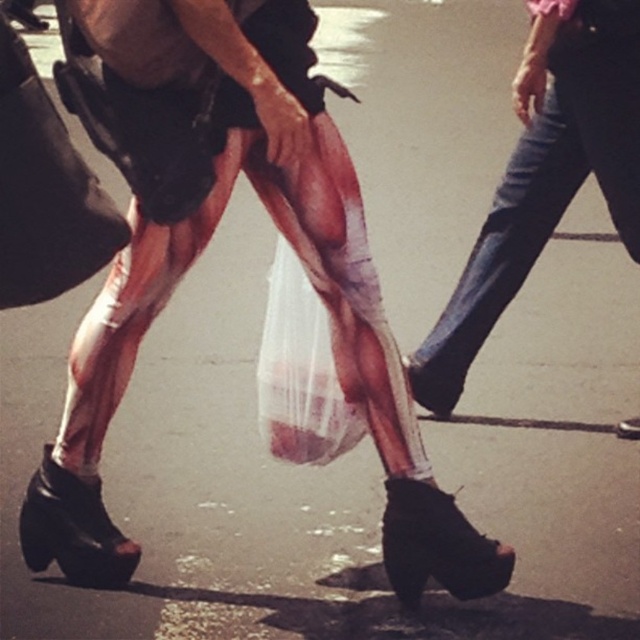
You are a fashion designer observing the two individuals in the image. You need to determine which lower garment has a larger width measurement between the metallic silver tights at center and the jeans at right. Based on the scene description, can you provide your assessment?

The metallic silver tights at center might be wider than jeans at right according to the description.

You are a photographer trying to capture the metallic silver tights at center in the image. The camera is positioned at the point with coordinates point (202, 252). Where should you aim your camera to ensure the metallic silver tights at center is in focus?

The point (202, 252) corresponds to the metallic silver tights at center, so you should aim your camera directly at that coordinate to ensure the metallic silver tights at center is in focus.